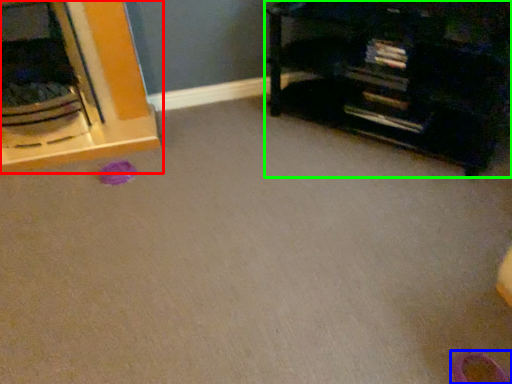
Question: Based on their relative distances, which object is farther from furniture (highlighted by a red box)? Choose from shoe (highlighted by a blue box) and furniture (highlighted by a green box).

Choices:
 (A) shoe
 (B) furniture

Answer: (A)